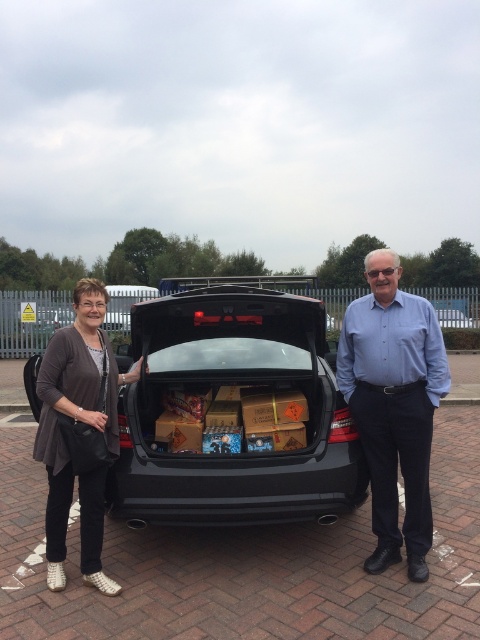
You are helping to organize items in the car trunk. You need to place a large box that requires 2 meters of vertical space. Can the dark gray sweater at left and the black matte car trunk at center accommodate this requirement?

The black matte car trunk at center is located above the dark gray sweater at left. Since the sweater is below the trunk, the vertical space available in the trunk itself would determine if the 2 meters is possible. However, car trunks typically don t have 2 meters of vertical space, so it s unlikely the box would fit.

In the scene shown: You are a photographer standing 2 meters away from the matte black car at center. You want to take a photo that requires you to be at least 3 meters away to avoid distortion. Can you take the photo from your current position?

The matte black car at center is 3.30 meters away from the camera. Since you are currently 2 meters away from the matte black car at center, you need to move back to at least 3 meters to avoid distortion. Therefore, you cannot take the photo from your current position.

You are helping to load items into the trunk of a car. You have a dark gray sweater at left that you want to place into the black matte car trunk at center. Based on their sizes, can the sweater fit inside the trunk?

The black matte car trunk at center might be wider than dark gray sweater at left, so there is a possibility that the sweater can fit inside the trunk.